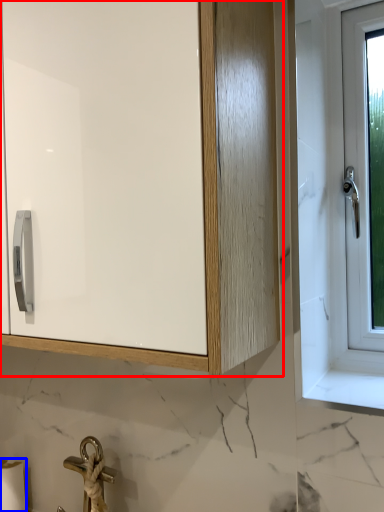
Question: Among these objects, which one is farthest to the camera, cabinetry (highlighted by a red box) or toilet paper (highlighted by a blue box)?

Choices:
 (A) cabinetry
 (B) toilet paper

Answer: (B)